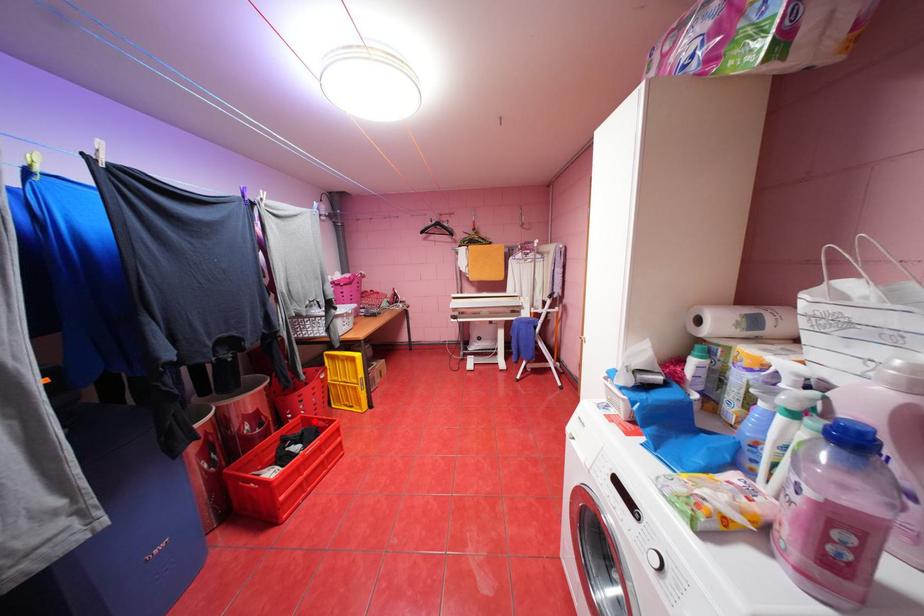
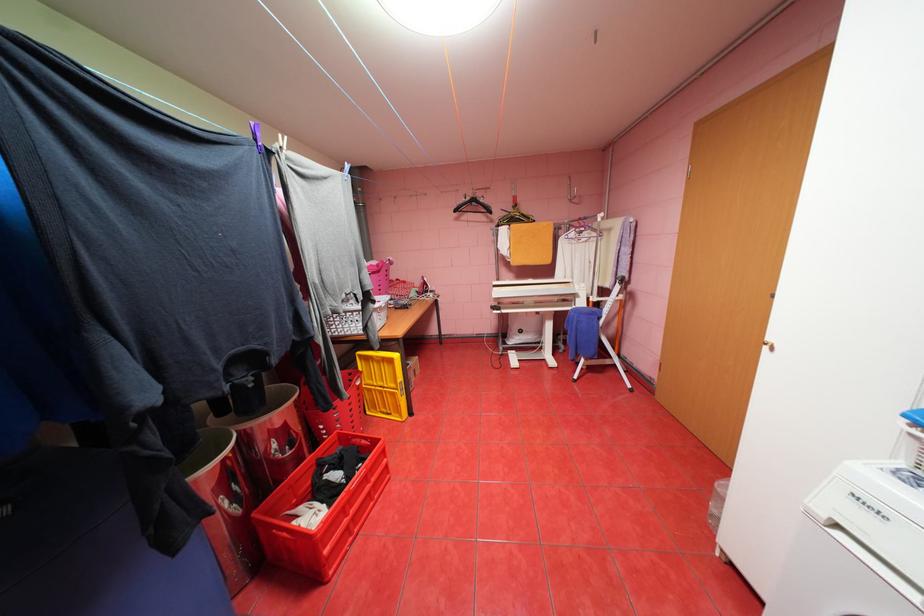
The point at the highlighted location is marked in the first image. Where is the corresponding point in the second image?

(351, 438)